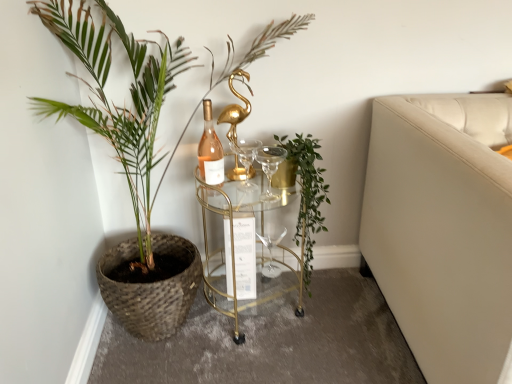
Question: From a real-world perspective, is green leafy plant at center, which ranks as the 2th houseplant in left-to-right order, physically located above or below transparent glass wine glass at center, positioned as the 2th wine glass in top-to-bottom order?

Choices:
 (A) above
 (B) below

Answer: (A)

Question: Is green leafy plant at center, which ranks as the 2th houseplant in left-to-right order, situated inside transparent glass wine glass at center, which is the first wine glass in back-to-front order, or outside?

Choices:
 (A) inside
 (B) outside

Answer: (B)

Question: Considering the real-world distances, which object is farthest from the gold glass table at center?

Choices:
 (A) clear glass wine glass at center, the 1th wine glass viewed from the top
 (B) green woven basket at left, the 2th houseplant from the right
 (C) green leafy plant at center, which ranks as the first houseplant in right-to-left order
 (D) transparent glass wine glass at center, which is the first wine glass in bottom-to-top order
 (E) matte glass wine bottle at center

Answer: (B)

Question: Which is nearer to the green leafy plant at center, which ranks as the first houseplant in right-to-left order?

Choices:
 (A) transparent glass wine glass at center, which is the first wine glass in back-to-front order
 (B) matte glass wine bottle at center
 (C) clear glass wine glass at center, which is the second wine glass in back-to-front order
 (D) gold glass table at center
 (E) green woven basket at left, the 1th houseplant when ordered from left to right

Answer: (D)